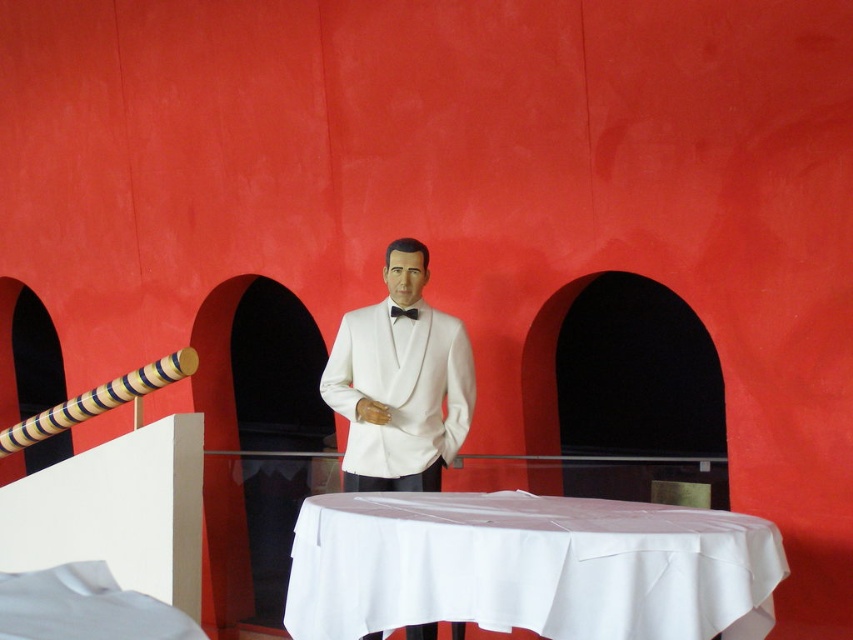
Looking at this image, you are standing at the entrance of the grand hall and see the white glossy tuxedo at center. If you walk straight ahead, will you reach the tuxedo before the staircase railing on the left?

The white glossy tuxedo at center is located at point (399, 381), which is closer to your current position at the entrance compared to the staircase railing on the left. Therefore, walking straight ahead will lead you to the tuxedo before reaching the railing.

You are standing at the position of point (459, 401) and want to move to the red wall with three arched cutouts. Can you walk directly towards the red wall without passing through point (454, 538)?

Yes, since point (454, 538) is in front of point (459, 401), you can walk directly towards the red wall without passing through point (454, 538) because it is already ahead of your current position.

You are standing at the bottom of the staircase with the yellow and black striped railing on the left. You want to take a photo of the white glossy tuxedo at center from a specific angle. The point at coordinates point (399,381) is where you need to aim your camera. Can you confirm if this point is indeed where the white glossy tuxedo at center is located?

Yes, the point (399,381) corresponds to the white glossy tuxedo at center, so aiming your camera at this coordinate will capture the tuxedo correctly.